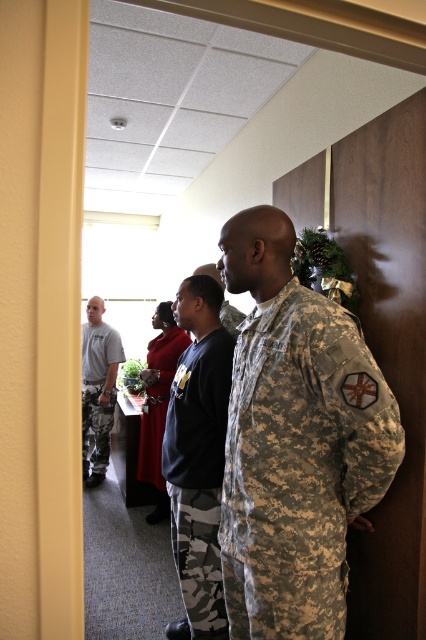
Between point (198, 504) and point (170, 362), which one is positioned behind?

Point (170, 362)

How much distance is there between camo fabric uniform at center and camouflage fabric uniform at center?

The distance of camo fabric uniform at center from camouflage fabric uniform at center is 4.50 feet.

Find the location of a particular element. This screenshot has height=640, width=426. camo fabric uniform at center is located at coordinates (198, 474).

Is point (160, 388) positioned behind point (236, 310)?

Yes.

Is camouflage fabric uniform at center above camouflage uniform at center?

No, camouflage fabric uniform at center is not above camouflage uniform at center.

Identify the location of camouflage fabric uniform at center. Image resolution: width=426 pixels, height=640 pixels. [158, 403].

This screenshot has width=426, height=640. In order to click on camouflage fabric uniform at center in this screenshot , I will do `click(158, 403)`.

Is the position of camouflage fabric uniform at right less distant than that of camouflage uniform at center?

Yes, it is.

Based on the photo, is camouflage fabric uniform at right taller than camouflage uniform at center?

Correct, camouflage fabric uniform at right is much taller as camouflage uniform at center.

Measure the distance between camouflage fabric uniform at right and camera.

A distance of 1.06 meters exists between camouflage fabric uniform at right and camera.

Locate an element on the screen. This screenshot has height=640, width=426. camouflage fabric uniform at right is located at coordinates (299, 465).